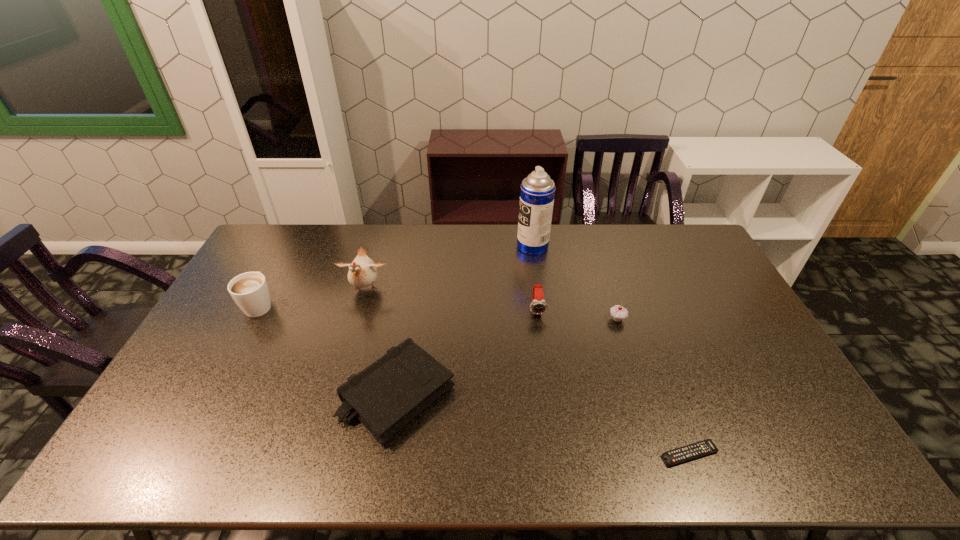
Locate an element on the screen. The image size is (960, 540). the farthest object is located at coordinates (537, 192).

The width and height of the screenshot is (960, 540). Identify the location of the tallest object. (537, 192).

Find the location of a particular element. bird is located at coordinates (362, 272).

Where is `the leftmost object`? The width and height of the screenshot is (960, 540). the leftmost object is located at coordinates (250, 291).

Where is `cappuccino`? The height and width of the screenshot is (540, 960). cappuccino is located at coordinates (250, 291).

The image size is (960, 540). In order to click on watch in this screenshot , I will do `click(538, 306)`.

The image size is (960, 540). What are the coordinates of `cupcake` in the screenshot? It's located at (618, 312).

This screenshot has width=960, height=540. What are the coordinates of `Bible` in the screenshot? It's located at (385, 396).

The height and width of the screenshot is (540, 960). In order to click on remote control in this screenshot , I will do `click(705, 447)`.

You are a GUI agent. You are given a task and a screenshot of the screen. Output one action in this format:
    pyautogui.click(x=<x>, y=<y>)
    Task: Click on the vacant space located on the label side of the farthest object
    
    Given the screenshot: What is the action you would take?
    pyautogui.click(x=454, y=246)